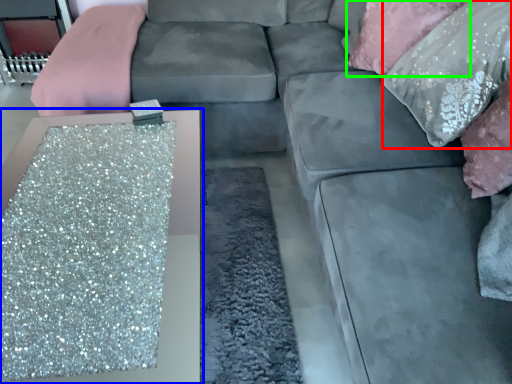
Question: Which object is the closest to the pillow (highlighted by a red box)? Choose among these: table (highlighted by a blue box) or pillow (highlighted by a green box).

Choices:
 (A) table
 (B) pillow

Answer: (B)